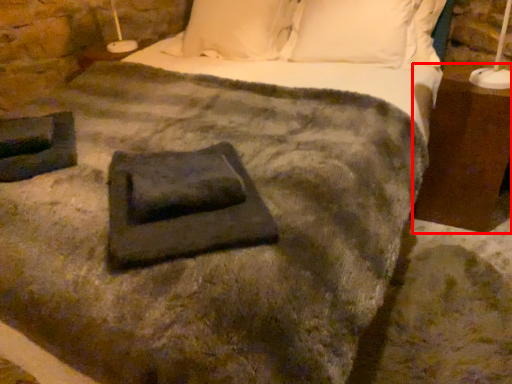
Question: From the image's perspective, what is the correct spatial positioning of nightstand (annotated by the red box) in reference to slate?

Choices:
 (A) above
 (B) below

Answer: (A)